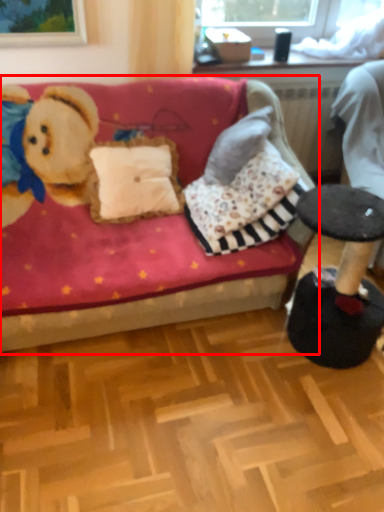
Question: Where is studio couch (annotated by the red box) located in relation to swivel chair in the image?

Choices:
 (A) left
 (B) right

Answer: (A)